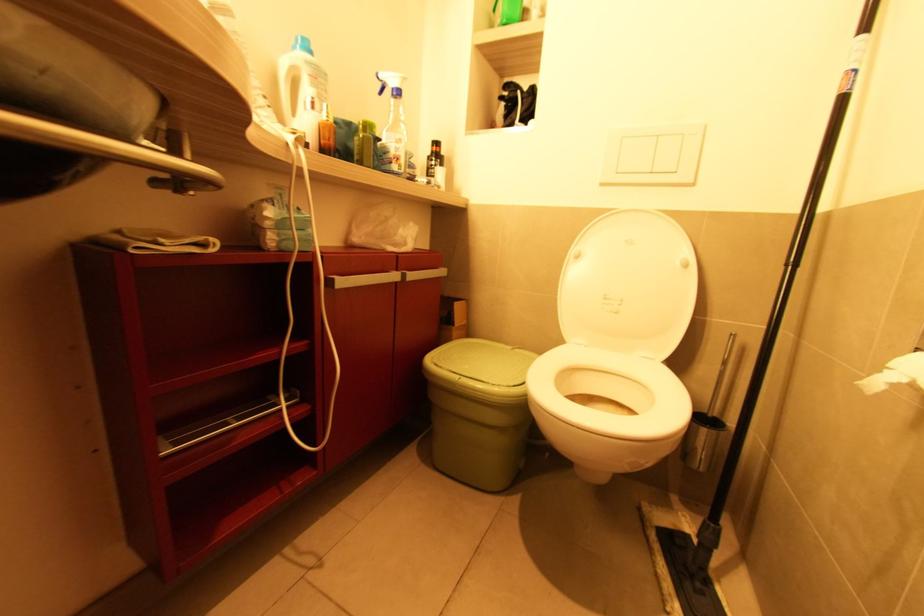
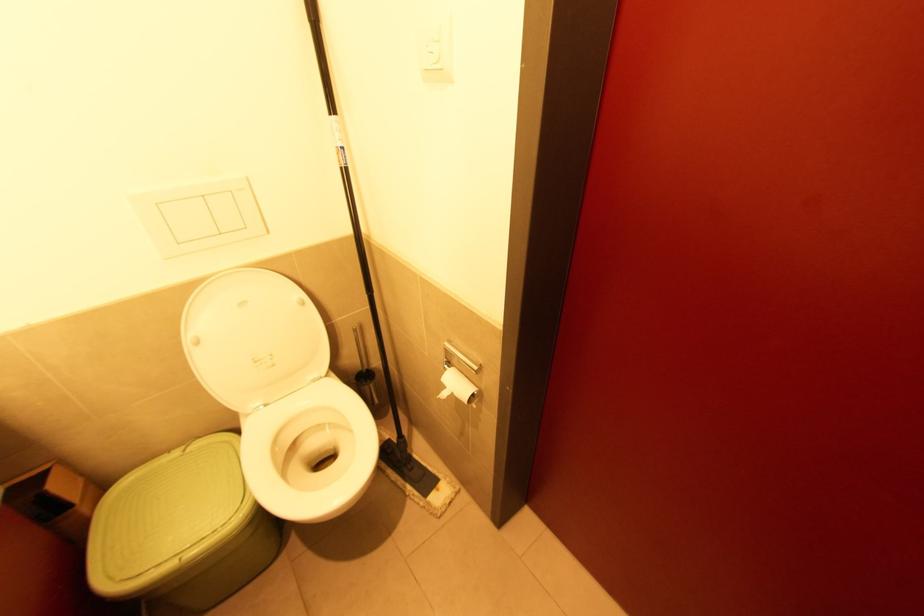
In the second image, find the point that corresponds to the point at 845,98 in the first image.

(347, 172)